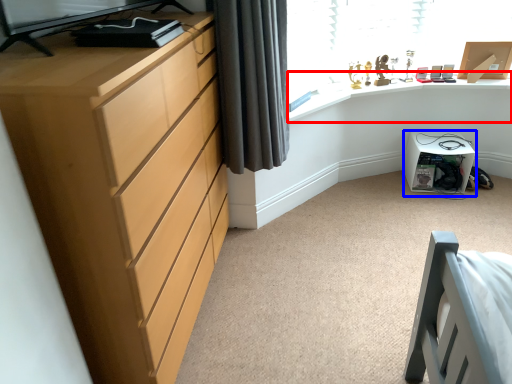
Question: Which object is further to the camera taking this photo, computer desk (highlighted by a red box) or cabinetry (highlighted by a blue box)?

Choices:
 (A) computer desk
 (B) cabinetry

Answer: (B)